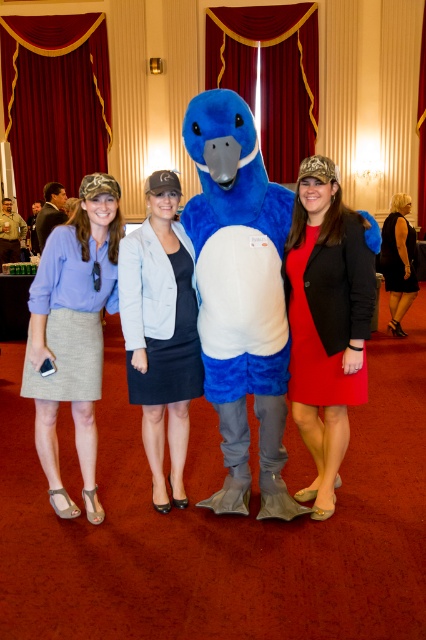
You are a photographer at the event and need to position yourself so that the fuzzy blue mascot at center is centered in your viewfinder. Given that the mascot is currently at coordinates point 0.463, 0.563, what adjustments should you make to your position to ensure the mascot is perfectly centered?

To center the fuzzy blue mascot at center in your viewfinder, you should adjust your position so that the mascot moves from its current coordinates point (239, 296) to the center point of the viewfinder, which is typically at coordinates (213, 320). This means moving slightly to the right and upward to compensate for the mascot being slightly to the left and lower than the desired center.

You are standing in the room and want to find the light gray woven skirt at left. Which direction should you look to see the point at coordinate (71, 316)?

The point at coordinate (71, 316) is located on the light gray woven skirt at left, so you should look towards the left side of the room to see it.

You are standing in the event room and want to reach a specific point marked at coordinates point (356, 316). If you are currently 2 meters away from that point, how much further do you need to walk to reach it?

The distance of point (356, 316) from viewer is 2.61 meters. Since you are currently 2 meters away, you need to walk an additional 0.61 meters to reach the point.